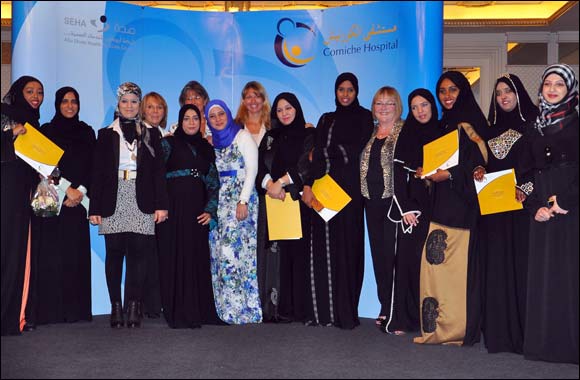
Where is `grey rug`? The image size is (580, 380). grey rug is located at coordinates (240, 352).